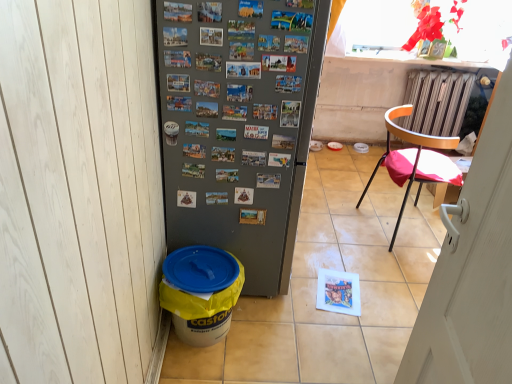
Locate an element on the screen. Image resolution: width=512 pixels, height=384 pixels. orange plastic chair at right is located at coordinates (437, 101).

Describe the element at coordinates (201, 292) in the screenshot. This screenshot has width=512, height=384. I see `yellow plastic bucket at lower left` at that location.

Where is `satin silver refrigerator at center`? The height and width of the screenshot is (384, 512). satin silver refrigerator at center is located at coordinates (239, 125).

Locate an element on the screen. The height and width of the screenshot is (384, 512). orange plastic chair at right is located at coordinates (437, 101).

Is translucent plastic window screen at upper right positioned with its back to yellow plastic bucket at lower left?

No.

Is translucent plastic window screen at upper right taller than yellow plastic bucket at lower left?

Yes, translucent plastic window screen at upper right is taller than yellow plastic bucket at lower left.

Considering the positions of objects translucent plastic window screen at upper right and yellow plastic bucket at lower left in the image provided, who is behind, translucent plastic window screen at upper right or yellow plastic bucket at lower left?

translucent plastic window screen at upper right is behind.

Can you confirm if translucent plastic window screen at upper right is positioned to the left of yellow plastic bucket at lower left?

No, translucent plastic window screen at upper right is not to the left of yellow plastic bucket at lower left.

Between translucent plastic window screen at upper right and orange plastic chair at right, which one has smaller size?

With smaller size is translucent plastic window screen at upper right.

From a real-world perspective, is translucent plastic window screen at upper right on orange plastic chair at right?

Yes, from a real-world perspective, translucent plastic window screen at upper right is over orange plastic chair at right

Considering the relative sizes of translucent plastic window screen at upper right and orange plastic chair at right in the image provided, is translucent plastic window screen at upper right thinner than orange plastic chair at right?

Correct, the width of translucent plastic window screen at upper right is less than that of orange plastic chair at right.

The image size is (512, 384). I want to click on refrigerator that appears above the yellow plastic bucket at lower left (from the image's perspective), so click(x=239, y=125).

Considering the points (272, 81) and (174, 321), which point is in front, point (272, 81) or point (174, 321)?

The point (272, 81) is closer to the camera.

Which object is further away from the camera taking this photo, satin silver refrigerator at center or yellow plastic bucket at lower left?

Positioned behind is yellow plastic bucket at lower left.

Based on the photo, is yellow plastic bucket at lower left not inside orange plastic chair at right?

That's correct, yellow plastic bucket at lower left is outside of orange plastic chair at right.

This screenshot has height=384, width=512. Find the location of `radiator behind the yellow plastic bucket at lower left`. radiator behind the yellow plastic bucket at lower left is located at coordinates (437, 101).

From a real-world perspective, is yellow plastic bucket at lower left located beneath orange plastic chair at right?

Yes, from a real-world perspective, yellow plastic bucket at lower left is below orange plastic chair at right.

Is yellow plastic bucket at lower left smaller than orange plastic chair at right?

Indeed, yellow plastic bucket at lower left has a smaller size compared to orange plastic chair at right.

In terms of height, does orange plastic chair at right look taller or shorter compared to wooden chair with red cushion at right?

orange plastic chair at right is shorter than wooden chair with red cushion at right.

You are a GUI agent. You are given a task and a screenshot of the screen. Output one action in this format:
    pyautogui.click(x=<x>, y=<y>)
    Task: Click on the chair that appears below the orange plastic chair at right (from a real-world perspective)
    
    Given the screenshot: What is the action you would take?
    pyautogui.click(x=415, y=160)

Looking at this image, from a real-world perspective, is orange plastic chair at right positioned above or below wooden chair with red cushion at right?

From a real-world perspective, orange plastic chair at right is physically above wooden chair with red cushion at right.

Is orange plastic chair at right positioned with its back to wooden chair with red cushion at right?

No, orange plastic chair at right's orientation is not away from wooden chair with red cushion at right.

From a real-world perspective, between orange plastic chair at right and satin silver refrigerator at center, who is vertically higher?

From a 3D spatial view, satin silver refrigerator at center is above.

Looking at the image, does orange plastic chair at right seem bigger or smaller compared to satin silver refrigerator at center?

orange plastic chair at right is smaller than satin silver refrigerator at center.

Who is shorter, orange plastic chair at right or satin silver refrigerator at center?

orange plastic chair at right is shorter.

From a real-world perspective, is wooden chair with red cushion at right beneath yellow plastic bucket at lower left?

No, from a real-world perspective, wooden chair with red cushion at right is not below yellow plastic bucket at lower left.

Would you consider wooden chair with red cushion at right to be distant from yellow plastic bucket at lower left?

wooden chair with red cushion at right is far away from yellow plastic bucket at lower left.

How far apart are wooden chair with red cushion at right and yellow plastic bucket at lower left?

1.25 meters.

Is the position of wooden chair with red cushion at right less distant than that of yellow plastic bucket at lower left?

No, it is behind yellow plastic bucket at lower left.

Where is `window screen that appears on the right of yellow plastic bucket at lower left`? window screen that appears on the right of yellow plastic bucket at lower left is located at coordinates (374, 29).

The image size is (512, 384). What are the coordinates of `radiator behind the translucent plastic window screen at upper right` in the screenshot? It's located at click(x=437, y=101).

Estimate the real-world distances between objects in this image. Which object is closer to translucent plastic window screen at upper right, yellow plastic bucket at lower left or orange plastic chair at right?

orange plastic chair at right is positioned closer to the anchor translucent plastic window screen at upper right.

Looking at the image, which one is located further to wooden chair with red cushion at right, orange plastic chair at right or satin silver refrigerator at center?

The object further to wooden chair with red cushion at right is satin silver refrigerator at center.

Which object lies further to the anchor point orange plastic chair at right, satin silver refrigerator at center or translucent plastic window screen at upper right?

satin silver refrigerator at center is positioned further to the anchor orange plastic chair at right.

Based on their spatial positions, is wooden chair with red cushion at right or yellow plastic bucket at lower left further from orange plastic chair at right?

yellow plastic bucket at lower left is further to orange plastic chair at right.

Looking at the image, which one is located closer to yellow plastic bucket at lower left, wooden chair with red cushion at right or translucent plastic window screen at upper right?

wooden chair with red cushion at right lies closer to yellow plastic bucket at lower left than the other object.

Considering their positions, is translucent plastic window screen at upper right positioned further to orange plastic chair at right than yellow plastic bucket at lower left?

yellow plastic bucket at lower left.

Looking at the image, which one is located further to wooden chair with red cushion at right, satin silver refrigerator at center or translucent plastic window screen at upper right?

satin silver refrigerator at center.

Looking at the image, which one is located further to translucent plastic window screen at upper right, yellow plastic bucket at lower left or satin silver refrigerator at center?

yellow plastic bucket at lower left is further to translucent plastic window screen at upper right.

Where is `refrigerator located between yellow plastic bucket at lower left and wooden chair with red cushion at right in the left-right direction`? This screenshot has height=384, width=512. refrigerator located between yellow plastic bucket at lower left and wooden chair with red cushion at right in the left-right direction is located at coordinates (239, 125).

This screenshot has height=384, width=512. I want to click on chair that lies between translucent plastic window screen at upper right and yellow plastic bucket at lower left from top to bottom, so click(415, 160).

The height and width of the screenshot is (384, 512). Find the location of `window screen between wooden chair with red cushion at right and orange plastic chair at right along the z-axis`. window screen between wooden chair with red cushion at right and orange plastic chair at right along the z-axis is located at coordinates (374, 29).

Where is `window screen positioned between satin silver refrigerator at center and orange plastic chair at right from near to far`? window screen positioned between satin silver refrigerator at center and orange plastic chair at right from near to far is located at coordinates (374, 29).